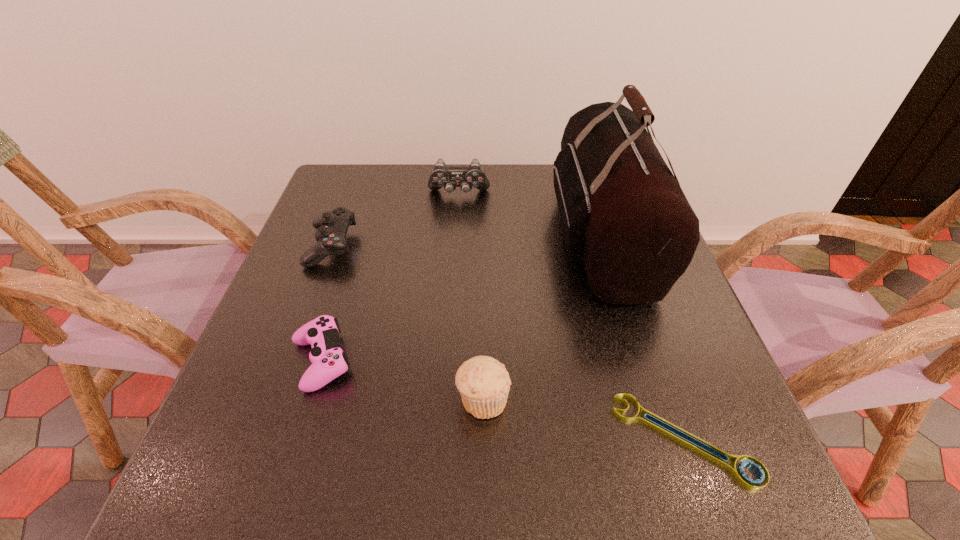
At what (x,y) coordinates should I click in order to perform the action: click on empty space that is in between the shortest control and the third tallest object. Please return your answer as a coordinate pair (x, y). The image size is (960, 540). Looking at the image, I should click on (402, 380).

What are the coordinates of `vacant area that lies between the rightmost control and the second nearest control` in the screenshot? It's located at (395, 221).

Locate an element on the screen. The width and height of the screenshot is (960, 540). vacant area that lies between the tallest object and the farthest control is located at coordinates (530, 215).

Locate an element on the screen. free space between the tallest object and the muffin is located at coordinates (542, 318).

I want to click on free space between the tallest control and the second farthest control, so click(395, 221).

Where is `empty location between the duffel bag and the second shortest control`? The image size is (960, 540). empty location between the duffel bag and the second shortest control is located at coordinates (466, 241).

Locate an element on the screen. free spot between the shortest object and the rightmost control is located at coordinates (571, 317).

In order to click on free space between the muffin and the wrench in this screenshot , I will do `click(584, 419)`.

Locate which object is the third closest to the shortest object. Please provide its 2D coordinates. Your answer should be formatted as a tuple, i.e. [(x, y)], where the tuple contains the x and y coordinates of a point satisfying the conditions above.

[(328, 360)]

Locate an element on the screen. This screenshot has width=960, height=540. object that stands as the second closest to the second shortest control is located at coordinates (449, 177).